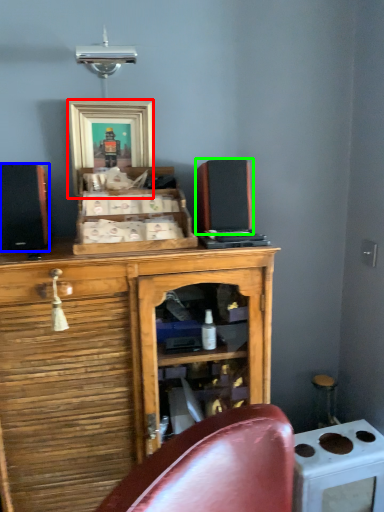
Question: Which object is the closest to the picture frame (highlighted by a red box)? Choose among these: speaker (highlighted by a blue box) or speaker (highlighted by a green box).

Choices:
 (A) speaker
 (B) speaker

Answer: (A)